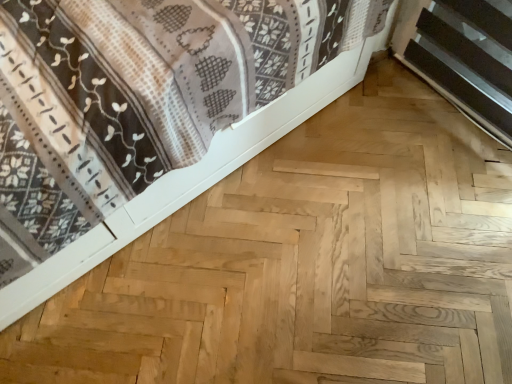
The width and height of the screenshot is (512, 384). What do you see at coordinates (152, 112) in the screenshot?
I see `natural wood bed frame at lower right` at bounding box center [152, 112].

Where is `natural wood bed frame at lower right`? The width and height of the screenshot is (512, 384). natural wood bed frame at lower right is located at coordinates (152, 112).

What is the approximate width of natural wood bed frame at lower right?

natural wood bed frame at lower right is 4.83 feet in width.

I want to click on natural wood bed frame at lower right, so click(152, 112).